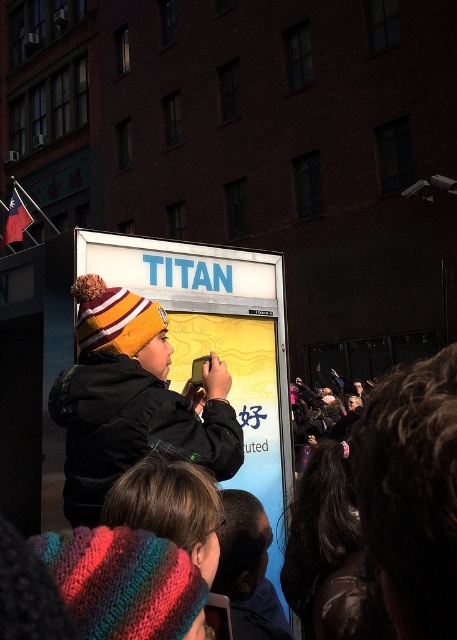
Who is more distant from viewer, (x=226, y=378) or (x=451, y=593)?

Point (x=226, y=378)

In the scene shown: Is knitted woolen hat at center shorter than dark brown hair at center?

No, knitted woolen hat at center is not shorter than dark brown hair at center.

Is point (105, 483) more distant than point (409, 506)?

Yes.

You are a GUI agent. You are given a task and a screenshot of the screen. Output one action in this format:
    pyautogui.click(x=<x>, y=<y>)
    Task: Click on the knitted woolen hat at center
    
    Given the screenshot: What is the action you would take?
    pyautogui.click(x=132, y=401)